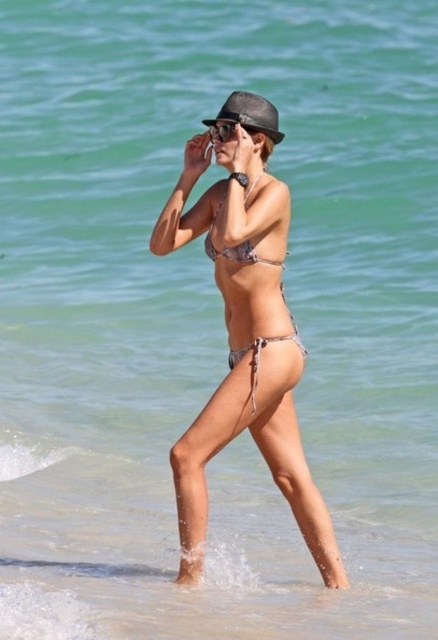
You are a photographer trying to capture the person at the beach. You need to ensure that both the black leather fedora at center and the black matte sunglasses at center are visible in the frame. Based on their positions, which object should appear higher in your photo?

The black leather fedora at center is located above the black matte sunglasses at center, so it will naturally appear higher in the photo.

You are standing on the beach and see the printed fabric bikini at center. If you want to reach it without getting wet, what is the minimum distance you need to walk?

The printed fabric bikini at center is 6.24 meters from the viewer, so you need to walk at least 6.24 meters to reach it without getting wet.

You are a photographer trying to capture the printed fabric bikini at center in a beach scene. Based on its coordinates, where should you position your camera to ensure it is centered in the frame?

The printed fabric bikini at center is located at point coordinates (260,353), so you should position your camera to aim directly at those coordinates to center it in the frame.